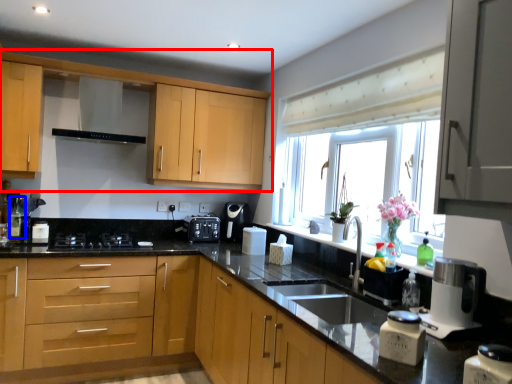
Question: Which object is further to the camera taking this photo, cabinetry (highlighted by a red box) or bottle (highlighted by a blue box)?

Choices:
 (A) cabinetry
 (B) bottle

Answer: (B)